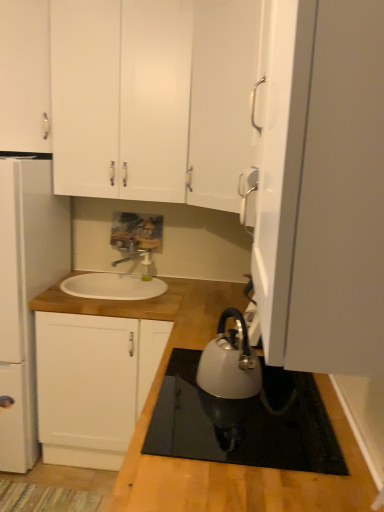
Question: Is white wood cabinet at center, which is counted as the first cabinetry, starting from the bottom, outside silver metallic faucet at center?

Choices:
 (A) yes
 (B) no

Answer: (A)

Question: Is white wood cabinet at center, which is counted as the first cabinetry, starting from the bottom, at the left side of silver metallic faucet at center?

Choices:
 (A) no
 (B) yes

Answer: (B)

Question: Does white wood cabinet at center, which is counted as the first cabinetry, starting from the bottom, have a smaller size compared to silver metallic faucet at center?

Choices:
 (A) yes
 (B) no

Answer: (B)

Question: Is white wood cabinet at center, which is counted as the first cabinetry, starting from the bottom, to the right of silver metallic faucet at center from the viewer's perspective?

Choices:
 (A) no
 (B) yes

Answer: (A)

Question: Is white wood cabinet at center, acting as the third cabinetry starting from the top, positioned with its back to silver metallic faucet at center?

Choices:
 (A) no
 (B) yes

Answer: (A)

Question: Is white wood cabinet at center, which is counted as the first cabinetry, starting from the bottom, bigger or smaller than satin silver kettle at lower center?

Choices:
 (A) big
 (B) small

Answer: (A)

Question: Considering the relative positions of white wood cabinet at center, which is counted as the first cabinetry, starting from the bottom, and satin silver kettle at lower center in the image provided, is white wood cabinet at center, which is counted as the first cabinetry, starting from the bottom, to the left or to the right of satin silver kettle at lower center?

Choices:
 (A) left
 (B) right

Answer: (A)

Question: Is white wood cabinet at center, acting as the third cabinetry starting from the top, taller or shorter than satin silver kettle at lower center?

Choices:
 (A) short
 (B) tall

Answer: (B)

Question: From the image's perspective, is white wood cabinet at center, which is counted as the first cabinetry, starting from the bottom, located above or below satin silver kettle at lower center?

Choices:
 (A) below
 (B) above

Answer: (A)

Question: In the image, is white matte cabinet at upper center, the second cabinetry positioned from the top, positioned in front of or behind white matte refrigerator at left?

Choices:
 (A) behind
 (B) front

Answer: (A)

Question: From a real-world perspective, is white matte cabinet at upper center, the second cabinetry positioned from the top, physically located above or below white matte refrigerator at left?

Choices:
 (A) below
 (B) above

Answer: (B)

Question: Considering the positions of white matte cabinet at upper center, placed as the second cabinetry when sorted from bottom to top, and white matte refrigerator at left in the image, is white matte cabinet at upper center, placed as the second cabinetry when sorted from bottom to top, taller or shorter than white matte refrigerator at left?

Choices:
 (A) short
 (B) tall

Answer: (A)

Question: From the image's perspective, is white matte cabinet at upper center, the second cabinetry positioned from the top, positioned above or below white matte refrigerator at left?

Choices:
 (A) below
 (B) above

Answer: (B)

Question: From a real-world perspective, is white matte cabinet at upper left, marked as the first cabinetry in a top-to-bottom arrangement, physically located above or below white matte cabinet at upper center, placed as the second cabinetry when sorted from bottom to top?

Choices:
 (A) above
 (B) below

Answer: (A)

Question: Looking at their shapes, would you say white matte cabinet at upper left, the third cabinetry from the bottom, is wider or thinner than white matte cabinet at upper center, the second cabinetry positioned from the top?

Choices:
 (A) thin
 (B) wide

Answer: (A)